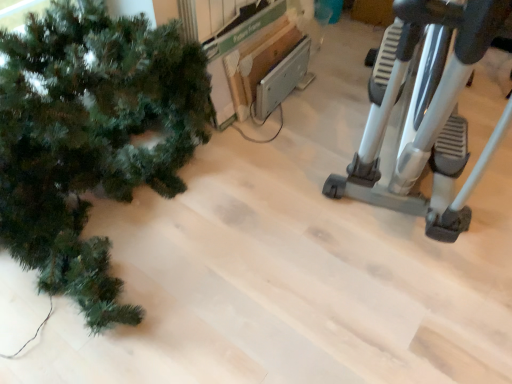
Question: From the image's perspective, is silver metallic stationary bicycle at right positioned above or below green matte christmas tree at left?

Choices:
 (A) below
 (B) above

Answer: (B)

Question: Is point (415, 41) closer or farther from the camera than point (76, 253)?

Choices:
 (A) farther
 (B) closer

Answer: (B)

Question: Relative to green matte christmas tree at left, is silver metallic stationary bicycle at right in front or behind?

Choices:
 (A) behind
 (B) front

Answer: (B)

Question: Choose the correct answer: Is green matte christmas tree at left inside silver metallic stationary bicycle at right or outside it?

Choices:
 (A) inside
 (B) outside

Answer: (B)

Question: In the image, is green matte christmas tree at left positioned in front of or behind silver metallic stationary bicycle at right?

Choices:
 (A) front
 (B) behind

Answer: (B)

Question: Considering the positions of point pos(22,43) and point pos(333,183), is point pos(22,43) closer or farther from the camera than point pos(333,183)?

Choices:
 (A) farther
 (B) closer

Answer: (B)

Question: Considering the relative positions of green matte christmas tree at left and silver metallic stationary bicycle at right in the image provided, is green matte christmas tree at left to the left or to the right of silver metallic stationary bicycle at right?

Choices:
 (A) left
 (B) right

Answer: (A)